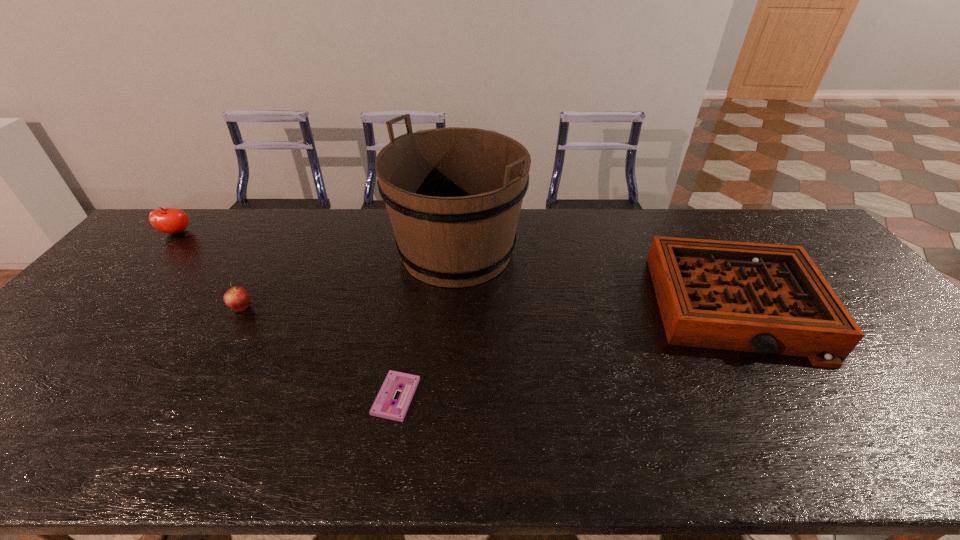
In the image, there is a desktop. At what (x,y) coordinates should I click in order to perform the action: click on free space at the far left corner. Please return your answer as a coordinate pair (x, y). This screenshot has width=960, height=540. Looking at the image, I should click on (192, 239).

This screenshot has height=540, width=960. In the image, there is a desktop. Find the location of `free region at the far right corner`. free region at the far right corner is located at coordinates (782, 242).

The image size is (960, 540). Find the location of `vacant area that lies between the videotape and the fourth object from right to left`. vacant area that lies between the videotape and the fourth object from right to left is located at coordinates (319, 352).

I want to click on free space that is in between the shortest object and the shorter apple, so click(319, 352).

I want to click on free area in between the shorter apple and the bucket, so click(349, 280).

Where is `free space between the bucket and the gameboard`? free space between the bucket and the gameboard is located at coordinates (597, 280).

Where is `free space between the gameboard and the bucket`? This screenshot has height=540, width=960. free space between the gameboard and the bucket is located at coordinates (597, 280).

Where is `free point between the nearest object and the leftmost object`? The image size is (960, 540). free point between the nearest object and the leftmost object is located at coordinates (286, 314).

Where is `free space between the nearest object and the leftmost object`? Image resolution: width=960 pixels, height=540 pixels. free space between the nearest object and the leftmost object is located at coordinates (286, 314).

This screenshot has width=960, height=540. I want to click on object that is the closest to the tallest object, so click(x=383, y=406).